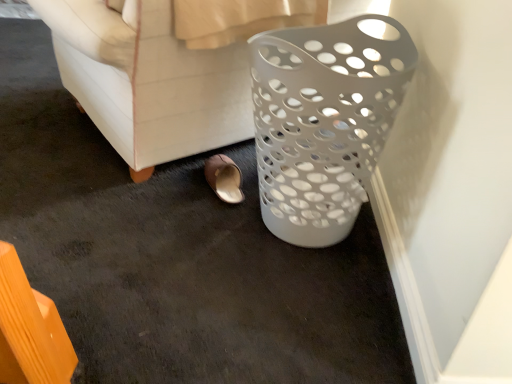
What is the approximate height of brown leather slipper at lower center?

brown leather slipper at lower center is 3.76 inches tall.

The image size is (512, 384). Describe the element at coordinates (323, 122) in the screenshot. I see `white plastic basket at right` at that location.

Image resolution: width=512 pixels, height=384 pixels. Identify the location of brown leather slipper at lower center. (224, 178).

Which is more to the right, white plastic laundry basket at right or brown leather slipper at lower center?

→ brown leather slipper at lower center is more to the right.

Looking at the image, does white plastic laundry basket at right seem bigger or smaller compared to brown leather slipper at lower center?

white plastic laundry basket at right is bigger than brown leather slipper at lower center.

Is white plastic laundry basket at right positioned before brown leather slipper at lower center?

Yes, white plastic laundry basket at right is closer to the viewer.

Considering the relative sizes of white plastic laundry basket at right and brown leather slipper at lower center in the image provided, is white plastic laundry basket at right wider than brown leather slipper at lower center?

Yes, white plastic laundry basket at right is wider than brown leather slipper at lower center.

Who is taller, white plastic laundry basket at right or white plastic basket at right?

white plastic laundry basket at right.

Is white plastic laundry basket at right inside the boundaries of white plastic basket at right, or outside?

white plastic laundry basket at right is located beyond the bounds of white plastic basket at right.

In the image, there is a white plastic laundry basket at right. Identify the location of basket below it (from a real-world perspective). This screenshot has height=384, width=512. (323, 122).

Which of these two, white plastic laundry basket at right or white plastic basket at right, is thinner?

With smaller width is white plastic basket at right.

Is brown leather slipper at lower center turned away from white plastic basket at right?

Absolutely, brown leather slipper at lower center is directed away from white plastic basket at right.

Does brown leather slipper at lower center have a greater width compared to white plastic basket at right?

In fact, brown leather slipper at lower center might be narrower than white plastic basket at right.

Are brown leather slipper at lower center and white plastic basket at right far apart?

No, there isn't a large distance between brown leather slipper at lower center and white plastic basket at right.

In the image, there is a brown leather slipper at lower center. Identify the location of basket above it (from the image's perspective). Image resolution: width=512 pixels, height=384 pixels. (323, 122).

From a real-world perspective, does white plastic basket at right stand above white plastic laundry basket at right?

Actually, white plastic basket at right is physically below white plastic laundry basket at right in the real world.

Does white plastic basket at right turn towards white plastic laundry basket at right?

Yes, white plastic basket at right is oriented towards white plastic laundry basket at right.

Find the location of `furniture behind the white plastic basket at right`. furniture behind the white plastic basket at right is located at coordinates (165, 70).

From a real-world perspective, is white plastic basket at right over brown leather slipper at lower center?

Yes, from a real-world perspective, white plastic basket at right is over brown leather slipper at lower center

Is white plastic basket at right in contact with brown leather slipper at lower center?

white plastic basket at right and brown leather slipper at lower center are clearly separated.

Where is `basket on the right of brown leather slipper at lower center`? The width and height of the screenshot is (512, 384). basket on the right of brown leather slipper at lower center is located at coordinates (323, 122).

Considering the positions of objects white plastic basket at right and brown leather slipper at lower center in the image provided, who is more to the left, white plastic basket at right or brown leather slipper at lower center?

brown leather slipper at lower center is more to the left.

Is brown leather slipper at lower center in front of or behind white plastic laundry basket at right in the image?

In the image, brown leather slipper at lower center appears behind white plastic laundry basket at right.

What's the angular difference between brown leather slipper at lower center and white plastic laundry basket at right's facing directions?

The angular difference between brown leather slipper at lower center and white plastic laundry basket at right is 21.6 degrees.

Locate an element on the screen. The width and height of the screenshot is (512, 384). footwear below the white plastic laundry basket at right (from the image's perspective) is located at coordinates (224, 178).

Is brown leather slipper at lower center facing away from white plastic laundry basket at right?

Absolutely, brown leather slipper at lower center is directed away from white plastic laundry basket at right.

The width and height of the screenshot is (512, 384). I want to click on footwear behind the white plastic laundry basket at right, so click(224, 178).

This screenshot has height=384, width=512. Identify the location of basket lying on the right of white plastic laundry basket at right. (323, 122).

Based on their spatial positions, is white plastic basket at right or brown leather slipper at lower center further from white plastic laundry basket at right?

Based on the image, brown leather slipper at lower center appears to be further to white plastic laundry basket at right.

Looking at the image, which one is located closer to white plastic basket at right, brown leather slipper at lower center or white plastic laundry basket at right?

white plastic laundry basket at right lies closer to white plastic basket at right than the other object.

From the picture: Estimate the real-world distances between objects in this image. Which object is further from white plastic laundry basket at right, brown leather slipper at lower center or white plastic basket at right?

brown leather slipper at lower center is further to white plastic laundry basket at right.

Based on their spatial positions, is white plastic laundry basket at right or white plastic basket at right closer to brown leather slipper at lower center?

Among the two, white plastic laundry basket at right is located nearer to brown leather slipper at lower center.

When comparing their distances from white plastic basket at right, does white plastic laundry basket at right or brown leather slipper at lower center seem further?

brown leather slipper at lower center.

Which object lies nearer to the anchor point brown leather slipper at lower center, white plastic basket at right or white plastic laundry basket at right?

white plastic laundry basket at right.

At what (x,y) coordinates should I click in order to perform the action: click on furniture located between white plastic basket at right and brown leather slipper at lower center in the depth direction. Please return your answer as a coordinate pair (x, y). This screenshot has height=384, width=512. Looking at the image, I should click on (165, 70).